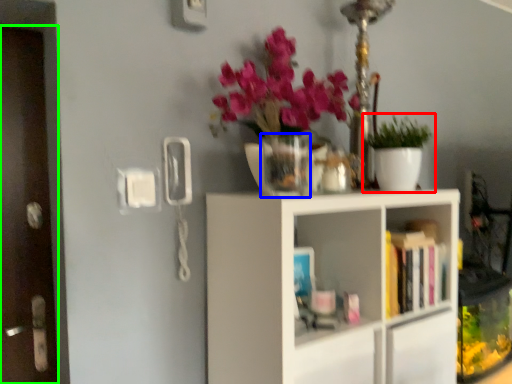
Question: Based on their relative distances, which object is farther from houseplant (highlighted by a red box)? Choose from vase (highlighted by a blue box) and door (highlighted by a green box).

Choices:
 (A) vase
 (B) door

Answer: (B)